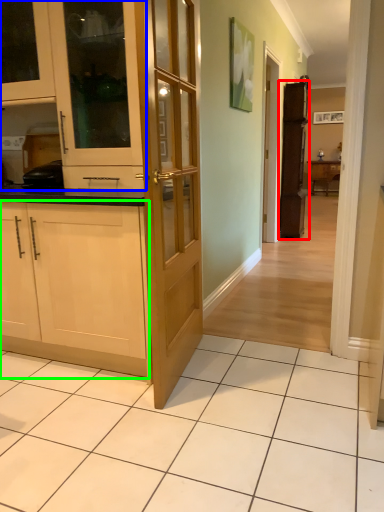
Question: Which object is positioned farthest from cabinetry (highlighted by a red box)? Select from cabinetry (highlighted by a blue box) and cabinetry (highlighted by a green box).

Choices:
 (A) cabinetry
 (B) cabinetry

Answer: (B)